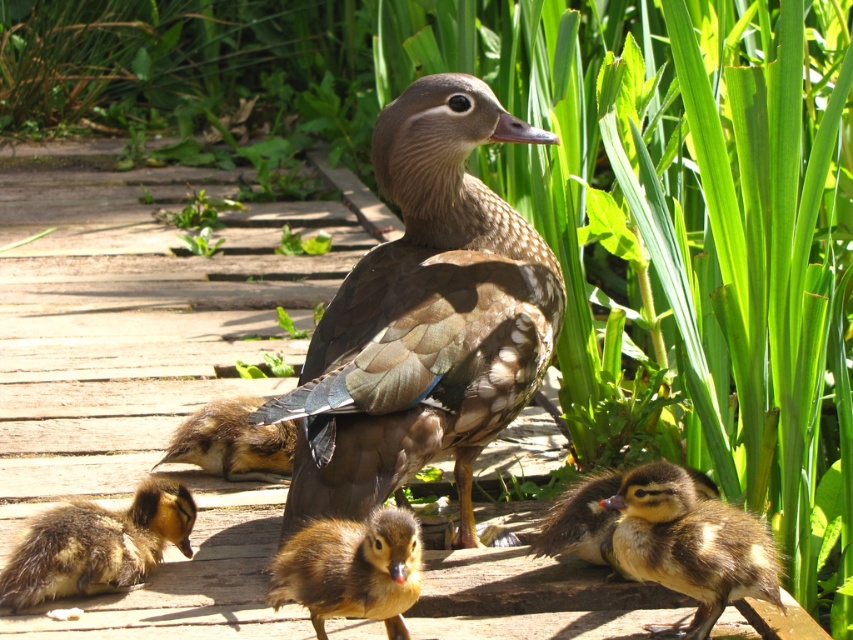
Who is shorter, brown fluffy duckling at lower left or brown fuzzy duckling at center?

brown fluffy duckling at lower left

Does brown fluffy duckling at lower left appear on the left side of brown fuzzy duckling at center?

Correct, you'll find brown fluffy duckling at lower left to the left of brown fuzzy duckling at center.

Between point (96, 508) and point (405, 630), which one is positioned behind?

The point (96, 508) is more distant.

At what (x,y) coordinates should I click in order to perform the action: click on brown fluffy duckling at lower left. Please return your answer as a coordinate pair (x, y). The height and width of the screenshot is (640, 853). Looking at the image, I should click on (97, 545).

Is point (68, 548) farther from viewer compared to point (598, 524)?

No, (68, 548) is in front of (598, 524).

Can you confirm if brown fluffy duckling at lower left is wider than brown fuzzy duckling at lower right?

Yes.

Where is `brown fluffy duckling at lower left`? brown fluffy duckling at lower left is located at coordinates (97, 545).

Is the position of brown fuzzy duckling at lower center less distant than that of brown fuzzy duckling at lower left?

Yes, it is in front of brown fuzzy duckling at lower left.

Which is in front, point (679, 552) or point (259, 433)?

Point (679, 552) is in front.

The width and height of the screenshot is (853, 640). What do you see at coordinates (691, 545) in the screenshot? I see `brown fuzzy duckling at lower center` at bounding box center [691, 545].

The height and width of the screenshot is (640, 853). What are the coordinates of `brown fuzzy duckling at lower center` in the screenshot? It's located at (691, 545).